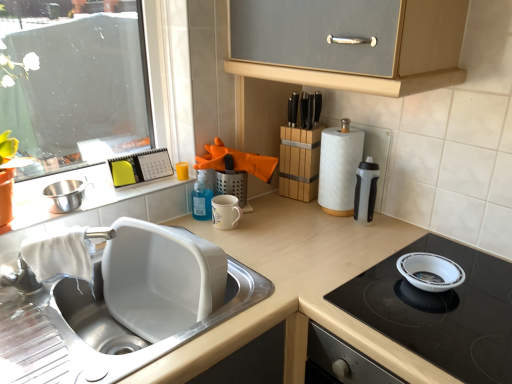
Locate an element on the screen. The height and width of the screenshot is (384, 512). free space to the left of translucent plastic water bottle at right is located at coordinates (311, 227).